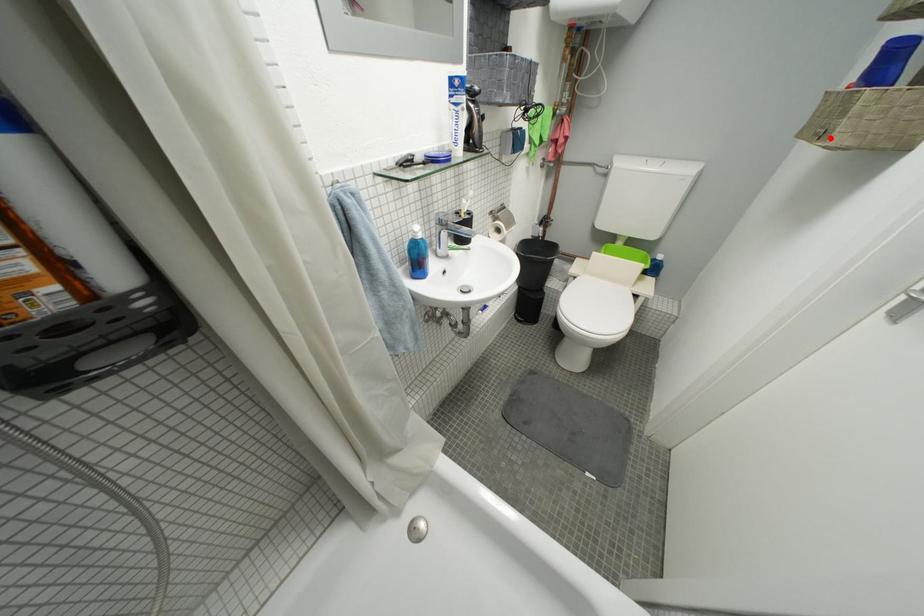
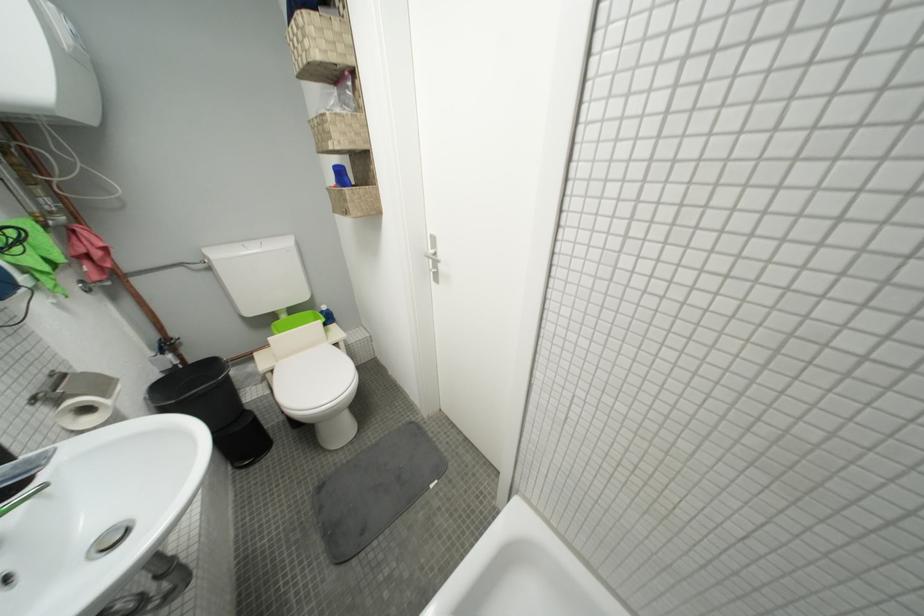
In the second image, find the point that corresponds to the highlighted location in the first image.

(354, 216)